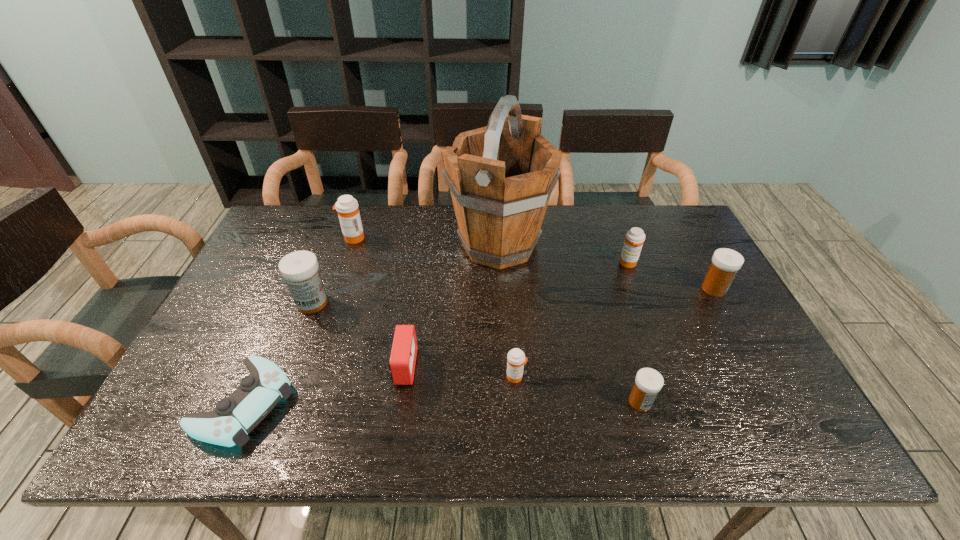
You are a GUI agent. You are given a task and a screenshot of the screen. Output one action in this format:
    pyautogui.click(x=<x>, y=<y>)
    Task: Click on the object located at the near left corner
    This screenshot has height=540, width=960.
    Given the screenshot: What is the action you would take?
    pyautogui.click(x=234, y=417)

This screenshot has height=540, width=960. Identify the location of vacant position at the far edge of the desktop. (363, 212).

Identify the location of vacant space at the near edge of the desktop. The image size is (960, 540). (519, 446).

Where is `vacant space at the left edge of the desktop`? vacant space at the left edge of the desktop is located at coordinates (274, 279).

I want to click on free space at the right edge of the desktop, so click(x=724, y=314).

Locate an element on the screen. vacant space at the far left corner of the desktop is located at coordinates (322, 218).

The height and width of the screenshot is (540, 960). In the image, there is a desktop. Identify the location of vacant space at the far right corner. (652, 241).

In the image, there is a desktop. Find the location of `blank space at the near right corner`. blank space at the near right corner is located at coordinates (786, 430).

I want to click on vacant space that's between the red alarm clock and the third medicine from left to right, so click(x=460, y=372).

The width and height of the screenshot is (960, 540). Find the location of `vacant region between the second farthest medicine and the control`. vacant region between the second farthest medicine and the control is located at coordinates (436, 333).